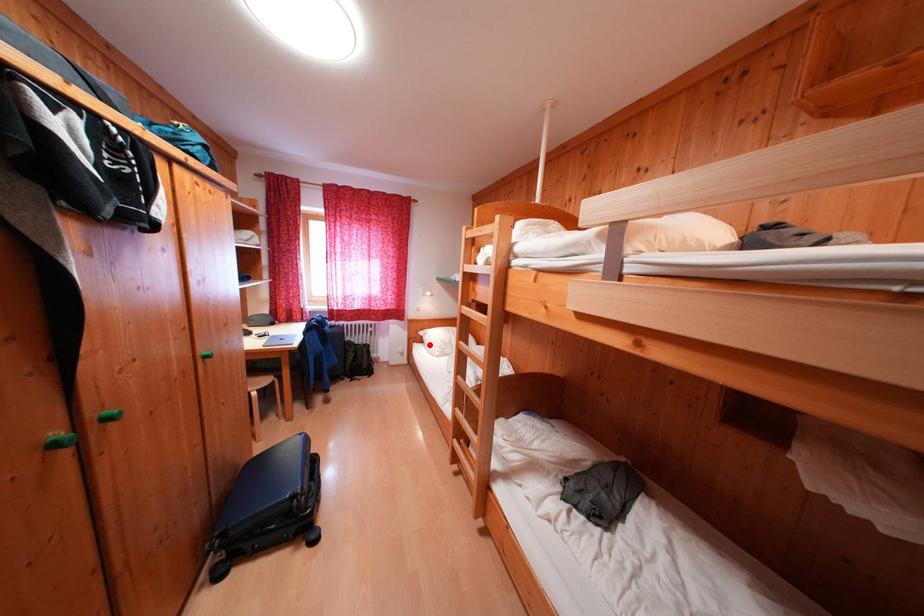
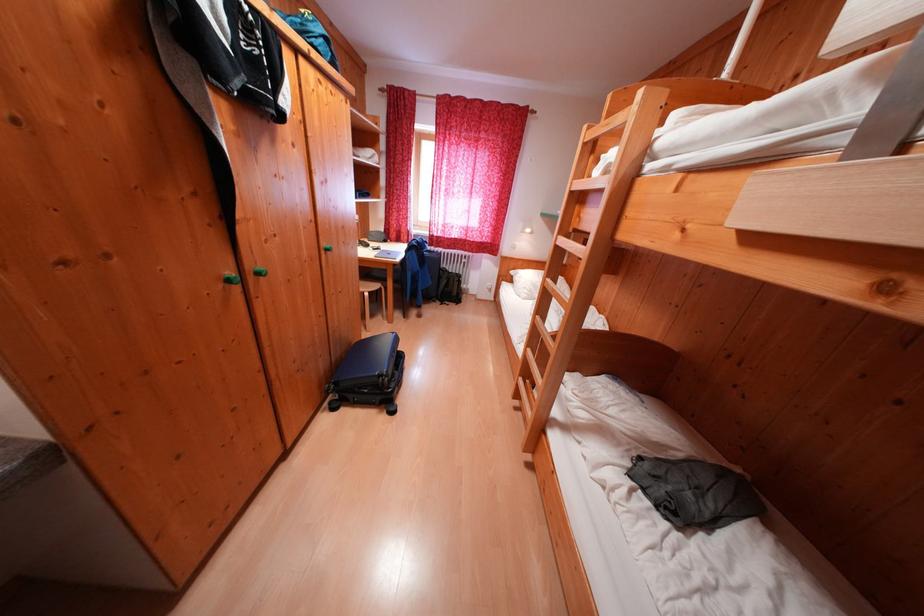
Locate, in the second image, the point that corresponds to the highlighted location in the first image.

(518, 284)